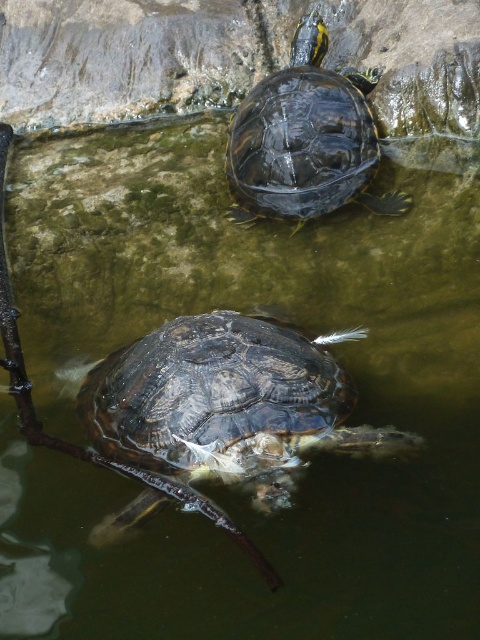
Question: Can you confirm if shiny dark turtle at center is positioned to the right of shiny dark turtle at upper center?

Choices:
 (A) yes
 (B) no

Answer: (B)

Question: Which of the following is the farthest from the observer?

Choices:
 (A) shiny dark turtle at upper center
 (B) shiny dark turtle at center

Answer: (A)

Question: Is shiny dark turtle at center to the right of shiny dark turtle at upper center from the viewer's perspective?

Choices:
 (A) yes
 (B) no

Answer: (B)

Question: Which point appears farthest from the camera in this image?

Choices:
 (A) pos(325,131)
 (B) pos(299,349)

Answer: (A)

Question: Does shiny dark turtle at center have a lesser width compared to shiny dark turtle at upper center?

Choices:
 (A) no
 (B) yes

Answer: (A)